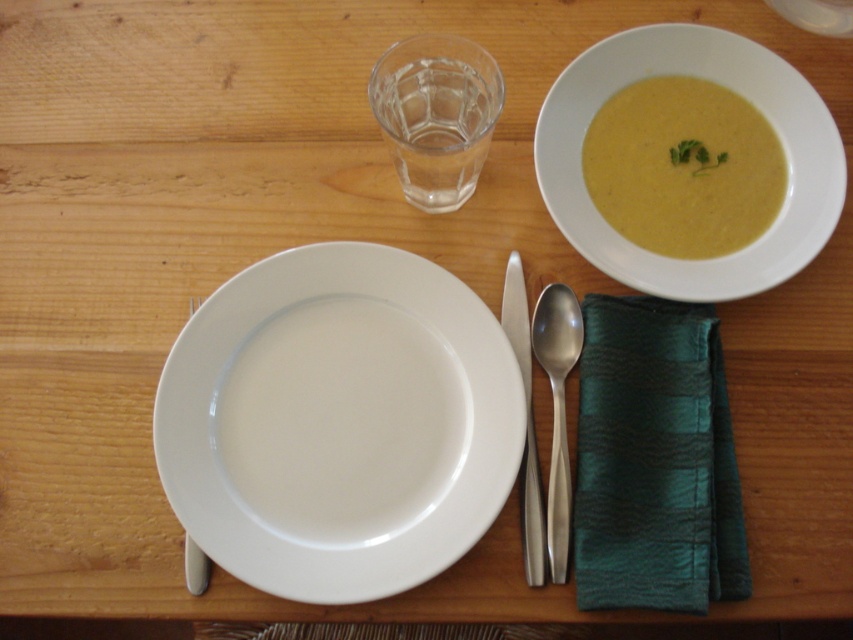
Question: Is yellow matte soup at upper right positioned before yellow creamy soup at upper right?

Choices:
 (A) no
 (B) yes

Answer: (B)

Question: Which of the following is the closest to the observer?

Choices:
 (A) satin silver spoon at center
 (B) silver metallic fork at lower left
 (C) yellow creamy soup at upper right
 (D) yellow matte soup at upper right

Answer: (B)

Question: Does white glossy plate at center have a larger size compared to yellow matte soup at upper right?

Choices:
 (A) no
 (B) yes

Answer: (B)

Question: Which object is farther from the camera taking this photo?

Choices:
 (A) satin silver spoon at center
 (B) yellow creamy soup at upper right

Answer: (B)

Question: Does yellow matte soup at upper right have a smaller size compared to silver metallic fork at lower left?

Choices:
 (A) yes
 (B) no

Answer: (B)

Question: Which of these objects is positioned farthest from the satin silver spoon at center?

Choices:
 (A) white glossy plate at center
 (B) yellow matte soup at upper right
 (C) yellow creamy soup at upper right
 (D) silver metallic fork at lower left

Answer: (D)